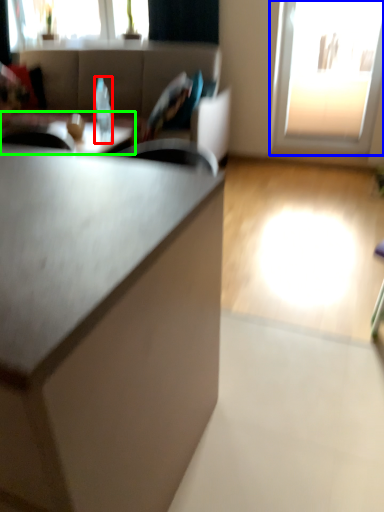
Question: Which object is the closest to the bottle (highlighted by a red box)? Choose among these: window (highlighted by a blue box) or table (highlighted by a green box).

Choices:
 (A) window
 (B) table

Answer: (B)